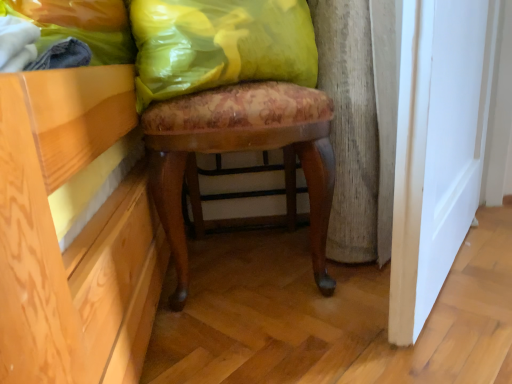
Question: In the image, is yellow fabric pillow at upper center on the left side or the right side of yellow plastic bag at upper left?

Choices:
 (A) left
 (B) right

Answer: (B)

Question: From a real-world perspective, relative to yellow plastic bag at upper left, is yellow fabric pillow at upper center vertically above or below?

Choices:
 (A) above
 (B) below

Answer: (B)

Question: Estimate the real-world distances between objects in this image. Which object is closer to the yellow plastic bag at upper left?

Choices:
 (A) floral fabric stool at center
 (B) yellow fabric pillow at upper center

Answer: (B)

Question: Which object is the farthest from the yellow plastic bag at upper left?

Choices:
 (A) yellow fabric pillow at upper center
 (B) floral fabric stool at center

Answer: (B)